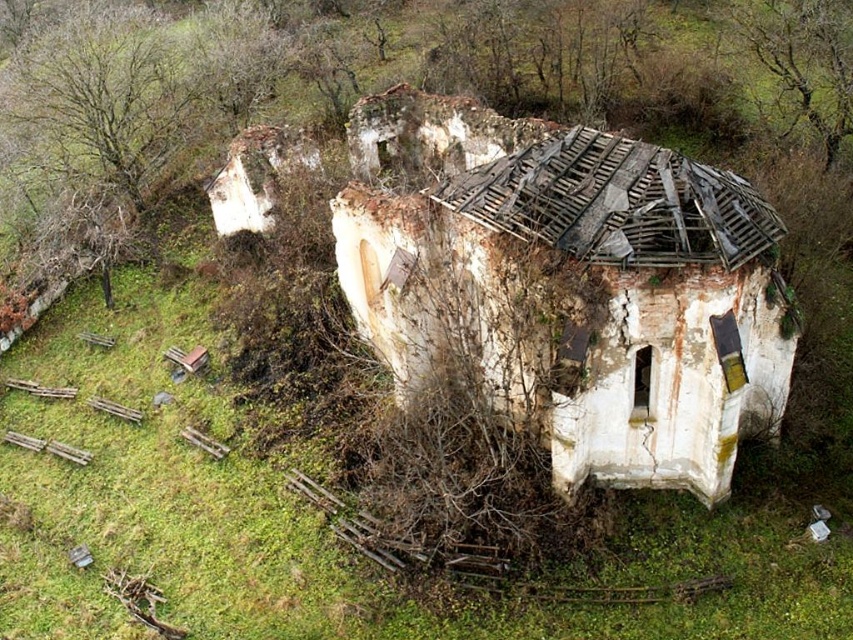
Can you confirm if white cracked stone hut at center is thinner than brown textured tree at upper right?

No.

Which is more to the right, white cracked stone hut at center or brown textured tree at upper right?

brown textured tree at upper right is more to the right.

This screenshot has width=853, height=640. What do you see at coordinates (581, 294) in the screenshot?
I see `white cracked stone hut at center` at bounding box center [581, 294].

Where is `white cracked stone hut at center`? This screenshot has height=640, width=853. white cracked stone hut at center is located at coordinates (581, 294).